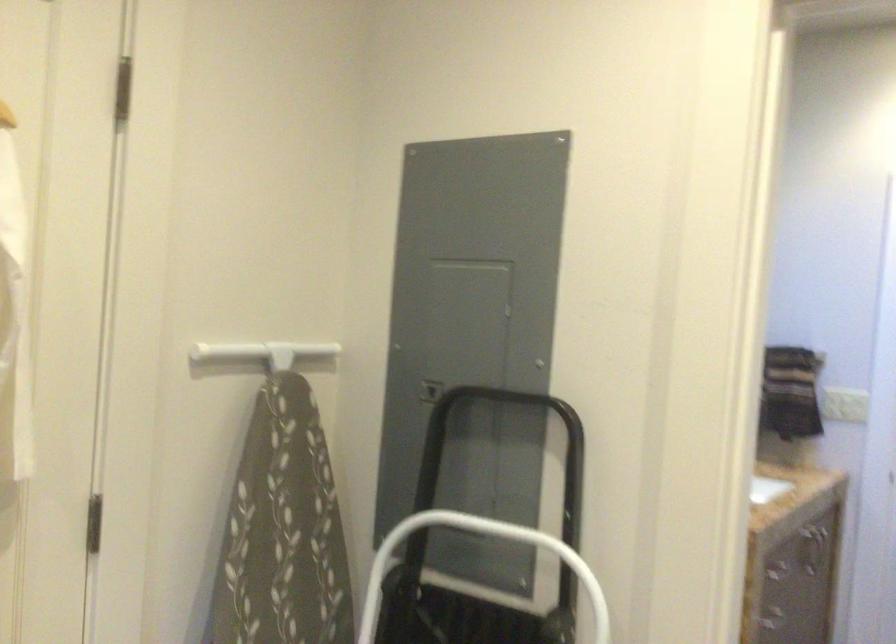
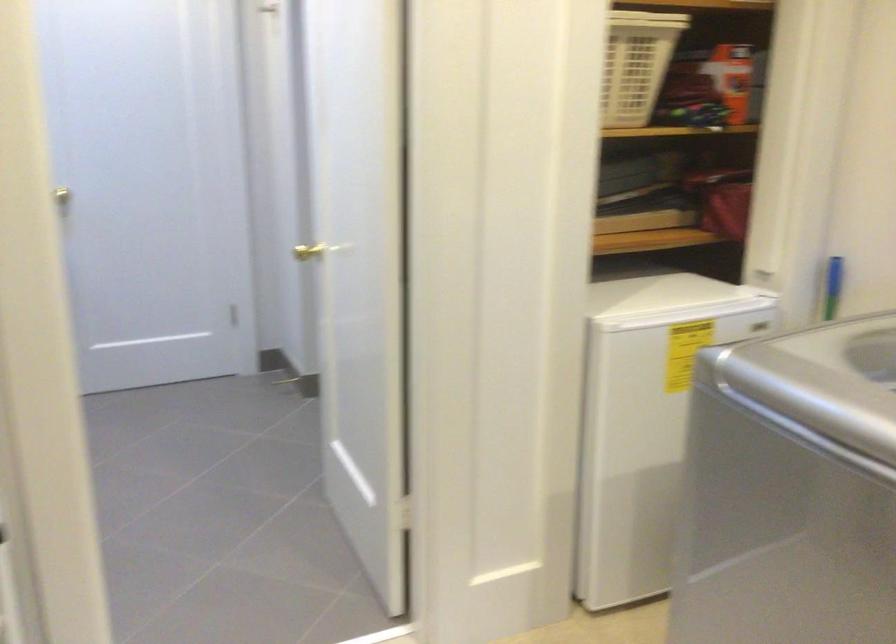
How did the camera likely rotate?

The rotation direction of the camera is right-down.